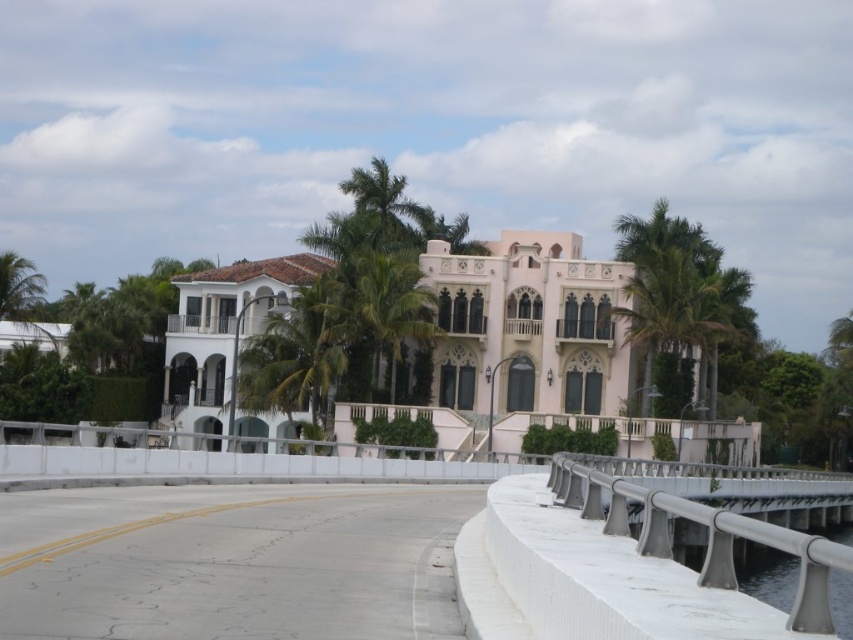
Is pink stucco mansion at center below green leafy palm tree at center?

Incorrect, pink stucco mansion at center is not positioned below green leafy palm tree at center.

Find the location of a particular element. Image resolution: width=853 pixels, height=640 pixels. pink stucco mansion at center is located at coordinates (540, 346).